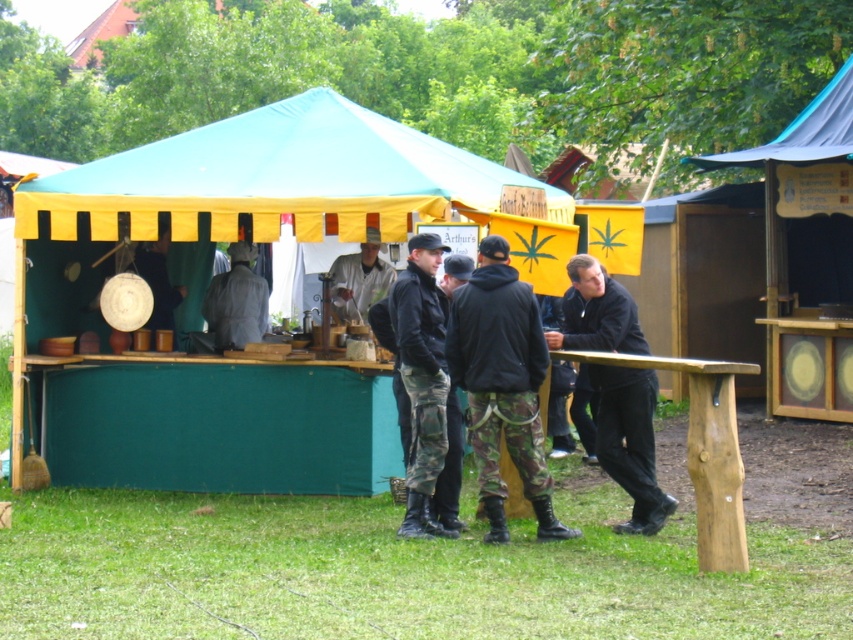
Question: Which point appears closest to the camera in this image?

Choices:
 (A) (590, 305)
 (B) (419, 445)
 (C) (339, 131)

Answer: (B)

Question: Does camouflage pants at center appear on the left side of light gray fabric jacket at center?

Choices:
 (A) no
 (B) yes

Answer: (A)

Question: Where is camouflage pants at center located in relation to silver metallic shirt at center in the image?

Choices:
 (A) right
 (B) left

Answer: (A)

Question: Among these objects, which one is nearest to the camera?

Choices:
 (A) teal fabric tent at center
 (B) silver metallic shirt at center
 (C) black matte jacket at center
 (D) camo pants at center

Answer: (D)

Question: Is teal fabric tent at center bigger than black matte jacket at center?

Choices:
 (A) yes
 (B) no

Answer: (A)

Question: Which point appears closest to the camera in this image?

Choices:
 (A) (477, 216)
 (B) (512, 342)
 (C) (355, 314)
 (D) (608, 276)

Answer: (B)